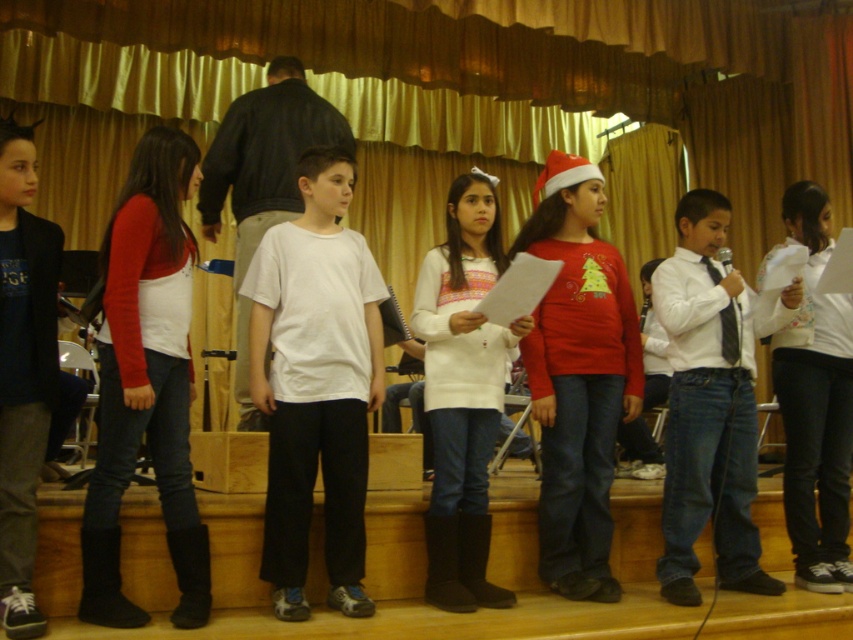
Between point (447, 486) and point (849, 326), which one is positioned behind?

The point (849, 326) is more distant.

Is white sweater at center positioned at the back of white floral shirt at center?

No, it is in front of white floral shirt at center.

This screenshot has width=853, height=640. Find the location of `white sweater at center`. white sweater at center is located at coordinates (462, 392).

Is white floral shirt at center bigger than dark gray pants at center?

Correct, white floral shirt at center is larger in size than dark gray pants at center.

Which is behind, point (824, 388) or point (18, 129)?

The point (824, 388) is more distant.

Which is in front, point (793, 228) or point (10, 212)?

Positioned in front is point (10, 212).

Locate an element on the screen. white floral shirt at center is located at coordinates (815, 403).

This screenshot has height=640, width=853. What do you see at coordinates (146, 381) in the screenshot? I see `matte white vest at center` at bounding box center [146, 381].

What do you see at coordinates (146, 381) in the screenshot?
I see `matte white vest at center` at bounding box center [146, 381].

This screenshot has width=853, height=640. What are the coordinates of `matte white vest at center` in the screenshot? It's located at (146, 381).